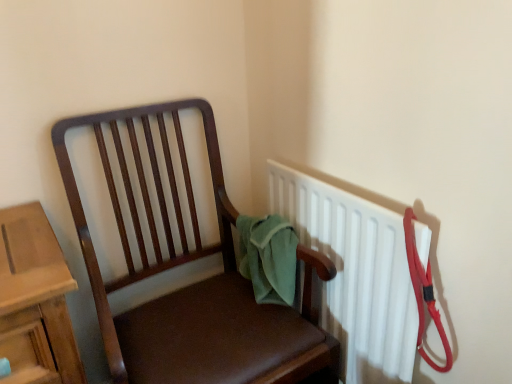
Question: Considering the relative sizes of matte brown chair at center and white plastic radiator at upper right in the image provided, is matte brown chair at center smaller than white plastic radiator at upper right?

Choices:
 (A) no
 (B) yes

Answer: (A)

Question: Can you confirm if matte brown chair at center is bigger than white plastic radiator at upper right?

Choices:
 (A) no
 (B) yes

Answer: (B)

Question: Can you confirm if matte brown chair at center is thinner than white plastic radiator at upper right?

Choices:
 (A) yes
 (B) no

Answer: (B)

Question: Is matte brown chair at center positioned before white plastic radiator at upper right?

Choices:
 (A) yes
 (B) no

Answer: (A)

Question: Is matte brown chair at center directly adjacent to white plastic radiator at upper right?

Choices:
 (A) no
 (B) yes

Answer: (A)

Question: Are matte brown chair at center and white plastic radiator at upper right located far from each other?

Choices:
 (A) no
 (B) yes

Answer: (A)

Question: Is white plastic radiator at upper right turned away from matte brown chair at center?

Choices:
 (A) no
 (B) yes

Answer: (B)

Question: Considering the relative positions of white plastic radiator at upper right and matte brown chair at center in the image provided, is white plastic radiator at upper right behind matte brown chair at center?

Choices:
 (A) yes
 (B) no

Answer: (A)

Question: Considering the relative sizes of white plastic radiator at upper right and matte brown chair at center in the image provided, is white plastic radiator at upper right bigger than matte brown chair at center?

Choices:
 (A) no
 (B) yes

Answer: (A)

Question: From a real-world perspective, is white plastic radiator at upper right physically below matte brown chair at center?

Choices:
 (A) yes
 (B) no

Answer: (B)

Question: Is white plastic radiator at upper right located outside matte brown chair at center?

Choices:
 (A) no
 (B) yes

Answer: (B)

Question: From the image's perspective, is white plastic radiator at upper right on matte brown chair at center?

Choices:
 (A) no
 (B) yes

Answer: (B)

Question: In terms of width, does matte brown chair at center look wider or thinner when compared to white plastic radiator at upper right?

Choices:
 (A) wide
 (B) thin

Answer: (A)